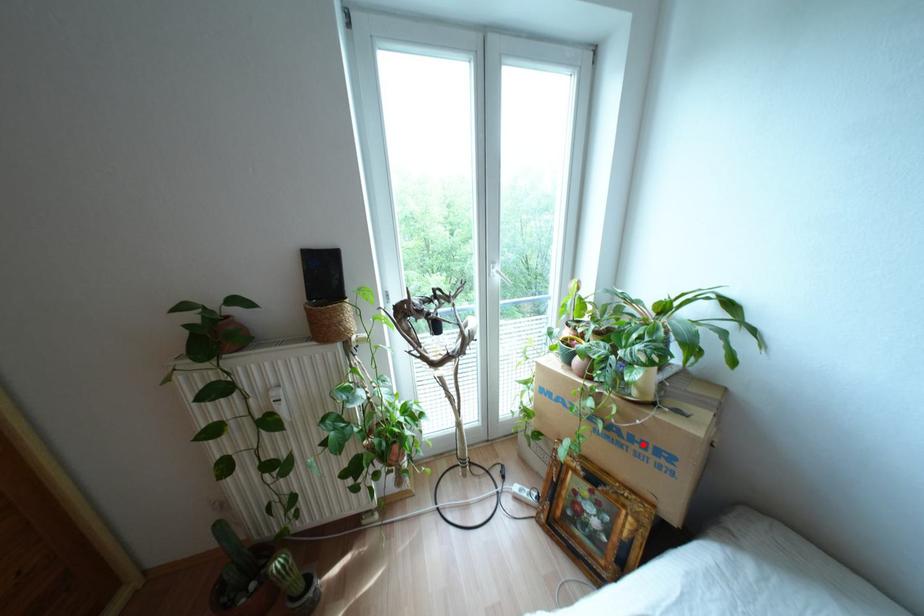
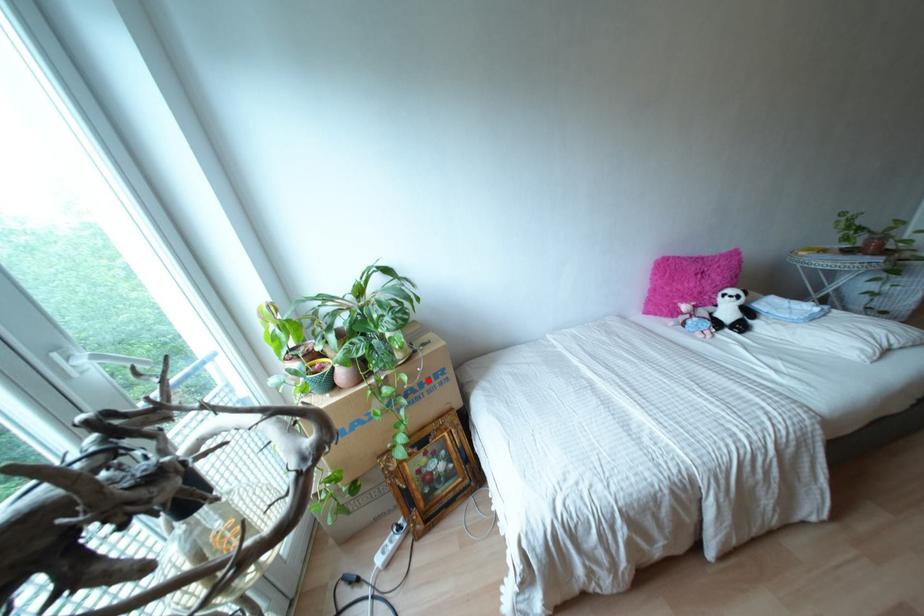
I am providing you with two images of the same scene from different viewpoints. A red point is marked on the first image and another point is marked on the second image. Is the red point in image1 aligned with the point shown in image2?

Yes